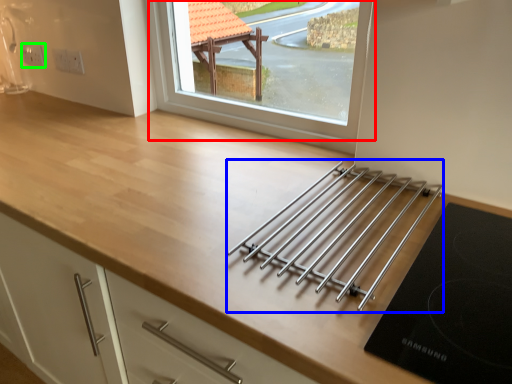
Question: Which object is the farthest from window (highlighted by a red box)? Choose among these: wide (highlighted by a blue box) or electric outlet (highlighted by a green box).

Choices:
 (A) wide
 (B) electric outlet

Answer: (B)